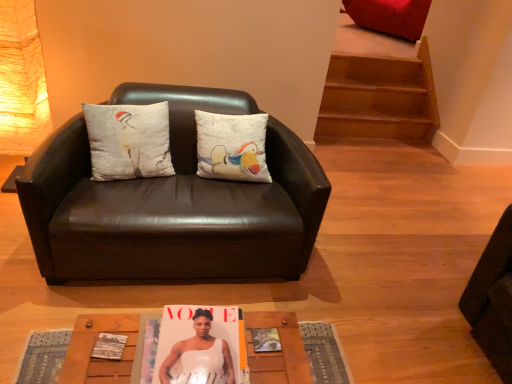
Identify the location of vacant area on top of white glossy magazine at center (from a real-world perspective). (200, 341).